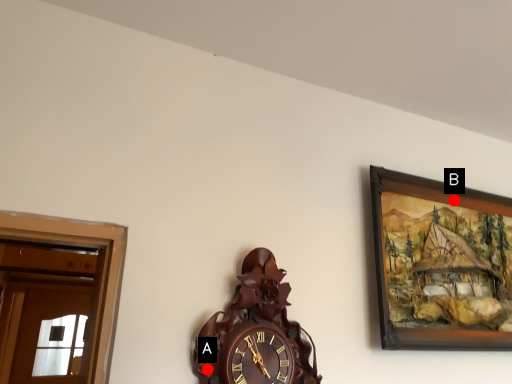
Question: Two points are circled on the image, labeled by A and B beside each circle. Among these points, which one is nearest to the camera?

Choices:
 (A) A is closer
 (B) B is closer

Answer: (A)